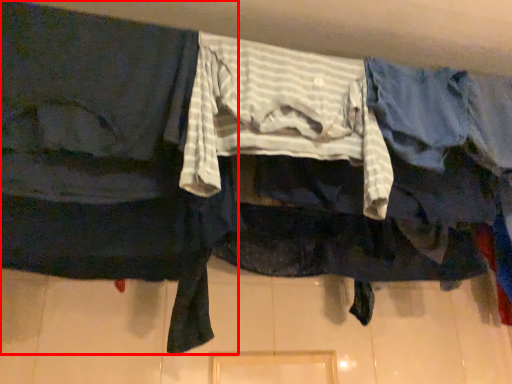
Question: From the image's perspective, considering the relative positions of robe (annotated by the red box) and clothing in the image provided, where is robe (annotated by the red box) located with respect to the staircase?

Choices:
 (A) above
 (B) below

Answer: (B)